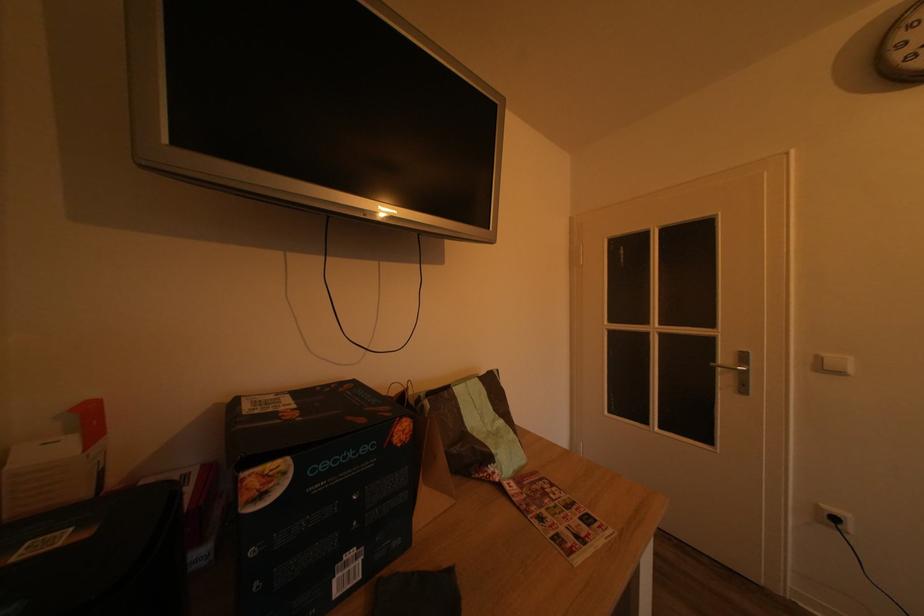
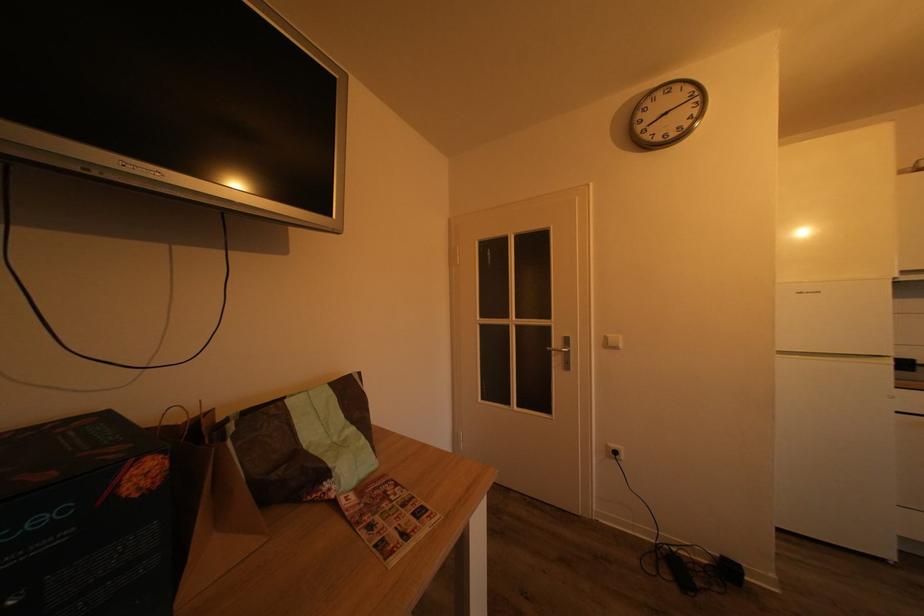
Question: What movement of the cameraman would produce the second image?

Choices:
 (A) Left
 (B) Right
 (C) Forward
 (D) Backward

Answer: (B)